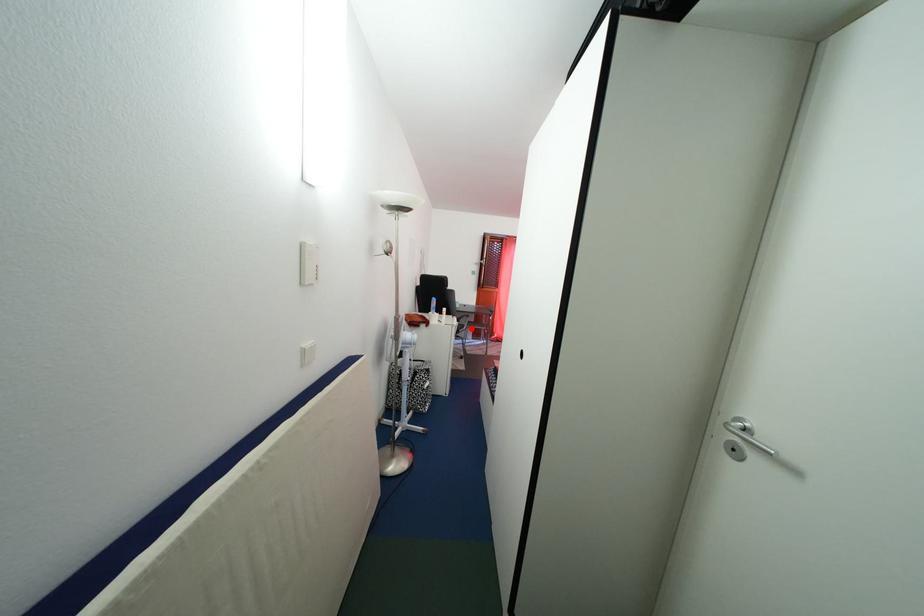
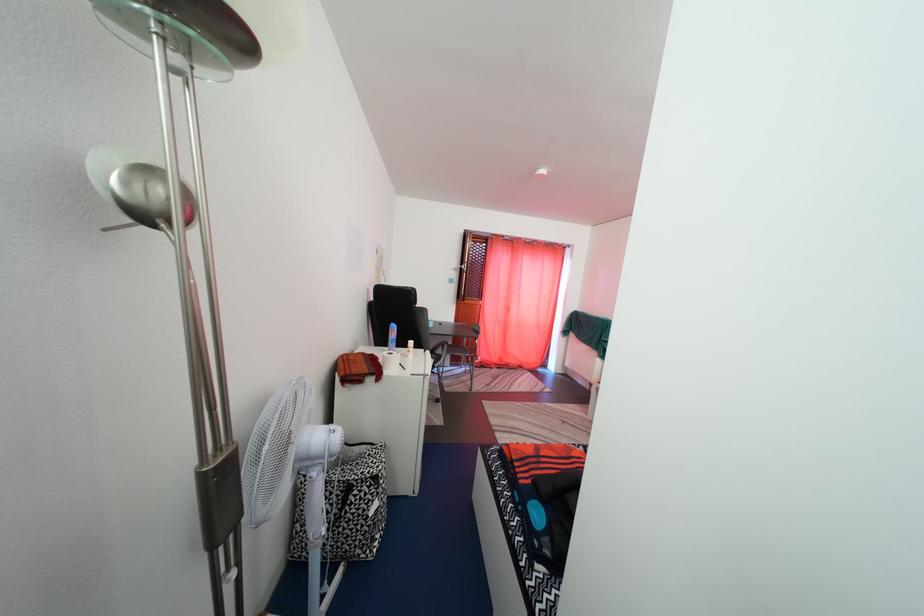
Question: I am providing you with two images of the same scene from different viewpoints. A red point is shown in image1. For the corresponding object point in image2, is it positioned nearer or farther from the camera?

Choices:
 (A) Nearer
 (B) Farther

Answer: (A)